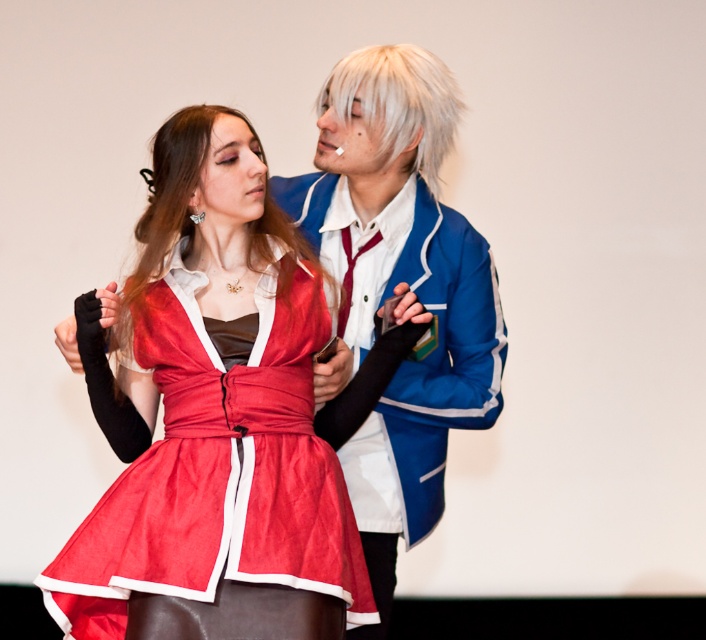
Question: Considering the real-world distances, which object is closest to the blonde silky hair at center?

Choices:
 (A) satin dress at center
 (B) white silky hair at upper center

Answer: (A)

Question: Which of the following is the closest to the observer?

Choices:
 (A) (395, 138)
 (B) (162, 168)

Answer: (B)

Question: Which of these objects is positioned farthest from the blue satin jacket at upper center?

Choices:
 (A) blonde silky hair at center
 (B) satin dress at center

Answer: (B)

Question: Does blonde silky hair at center appear on the left side of white silky hair at upper center?

Choices:
 (A) yes
 (B) no

Answer: (A)

Question: Does satin dress at center have a greater width compared to white silky hair at upper center?

Choices:
 (A) no
 (B) yes

Answer: (B)

Question: Can you confirm if blonde silky hair at center is smaller than white silky hair at upper center?

Choices:
 (A) yes
 (B) no

Answer: (B)